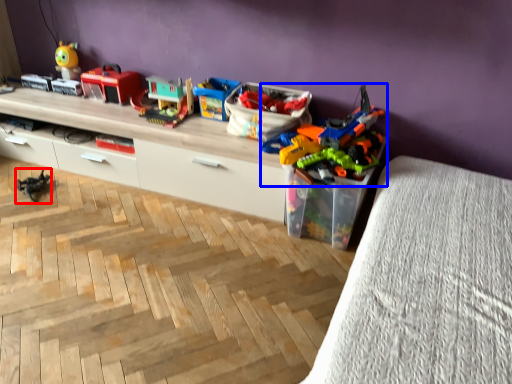
Question: Which point is closer to the camera, toy (highlighted by a red box) or toy (highlighted by a blue box)?

Choices:
 (A) toy
 (B) toy

Answer: (B)